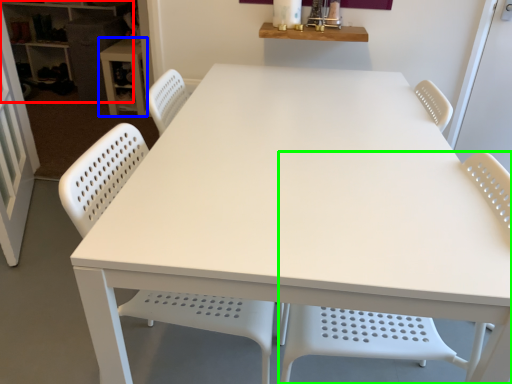
Question: Considering the real-world distances, which object is farthest from shelf (highlighted by a red box)? table (highlighted by a blue box) or chair (highlighted by a green box)?

Choices:
 (A) table
 (B) chair

Answer: (B)